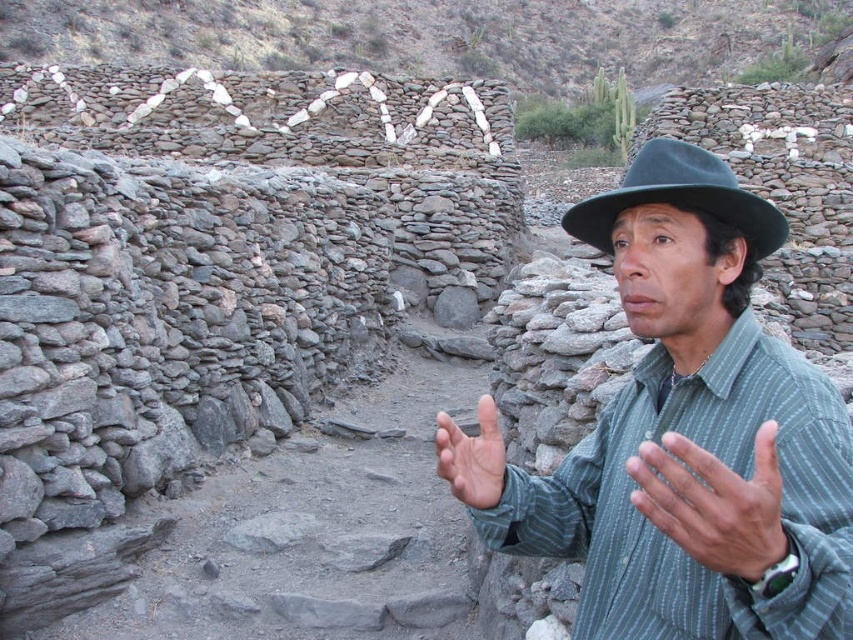
You are a photographer trying to capture a closeup shot of the green striped shirt at center and the black felt fedora at center. Your camera can focus on objects within a 10 feet range. Can you take the photo without moving closer?

The green striped shirt at center is 16.93 feet away from the black felt fedora at center. Since the camera can only focus within 10 feet, the photographer needs to move closer to ensure both objects are within the 10 feet range for proper focus.

You are a fashion designer analyzing the image. You need to determine which item is taller between the gray striped shirt at lower right and the black felt fedora at center. Based on the scene, which one is taller?

The black felt fedora at center is taller than the gray striped shirt at lower right.